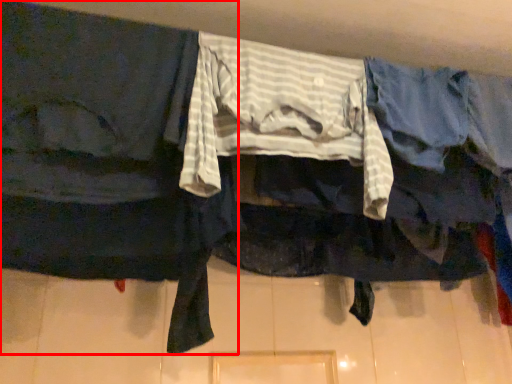
Question: Observing the image, what is the correct spatial positioning of robe (annotated by the red box) in reference to clothing?

Choices:
 (A) right
 (B) left

Answer: (B)